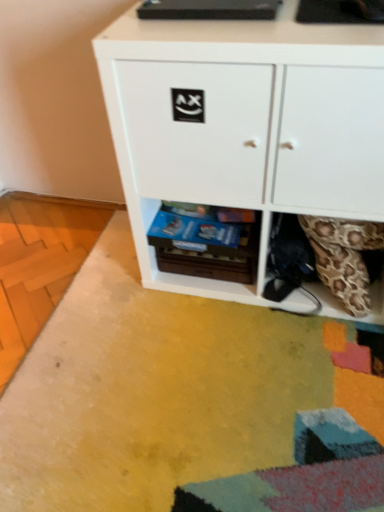
Question: In terms of width, does white matte cabinet at center look wider or thinner when compared to wooden drawer at lower center?

Choices:
 (A) wide
 (B) thin

Answer: (A)

Question: Looking at the image, does white matte cabinet at center seem bigger or smaller compared to wooden drawer at lower center?

Choices:
 (A) big
 (B) small

Answer: (A)

Question: From their relative heights in the image, would you say white matte cabinet at center is taller or shorter than wooden drawer at lower center?

Choices:
 (A) tall
 (B) short

Answer: (A)

Question: From the image's perspective, relative to white matte cabinet at center, is wooden drawer at lower center above or below?

Choices:
 (A) below
 (B) above

Answer: (A)

Question: Considering the relative positions of wooden drawer at lower center and white matte cabinet at center in the image provided, is wooden drawer at lower center to the left or to the right of white matte cabinet at center?

Choices:
 (A) left
 (B) right

Answer: (A)

Question: Is wooden drawer at lower center inside or outside of white matte cabinet at center?

Choices:
 (A) inside
 (B) outside

Answer: (A)

Question: Is wooden drawer at lower center in front of or behind white matte cabinet at center in the image?

Choices:
 (A) front
 (B) behind

Answer: (B)